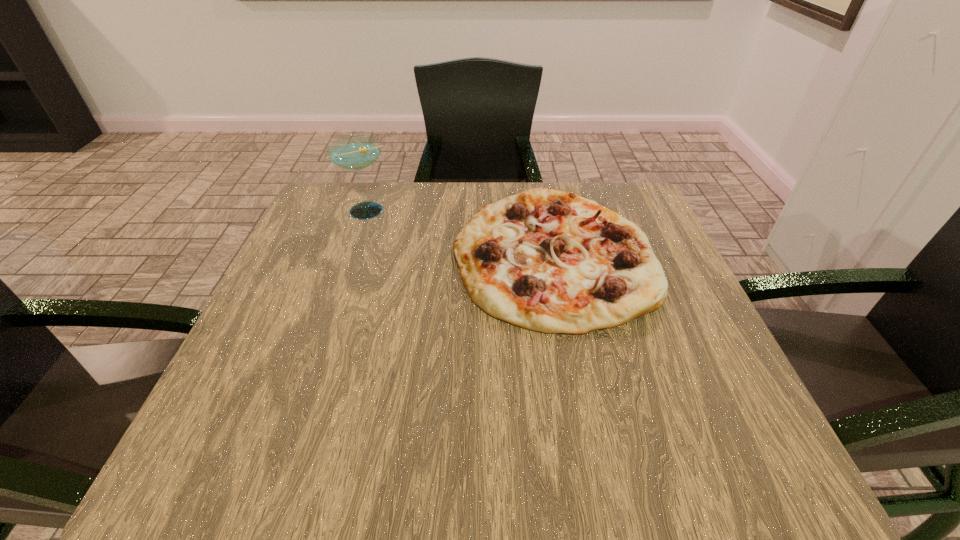
Locate an element on the screen. This screenshot has width=960, height=540. object present at the far left corner is located at coordinates (356, 152).

Locate an element on the screen. object that is at the far right corner is located at coordinates (548, 261).

Image resolution: width=960 pixels, height=540 pixels. In order to click on free spot at the far edge of the desktop in this screenshot , I will do `click(427, 228)`.

Find the location of a particular element. vacant space at the near edge of the desktop is located at coordinates (643, 438).

In the image, there is a desktop. Where is `vacant area at the left edge`? vacant area at the left edge is located at coordinates (313, 326).

In the image, there is a desktop. Identify the location of vacant space at the right edge. Image resolution: width=960 pixels, height=540 pixels. (733, 401).

Locate an element on the screen. The width and height of the screenshot is (960, 540). free region at the far left corner of the desktop is located at coordinates (344, 210).

Locate an element on the screen. The width and height of the screenshot is (960, 540). vacant space at the far right corner of the desktop is located at coordinates (629, 217).

The image size is (960, 540). In order to click on vacant point that satisfies the following two spatial constraints: 1. on the front side of the left object; 2. on the right side of the shorter object in this screenshot , I will do `click(353, 255)`.